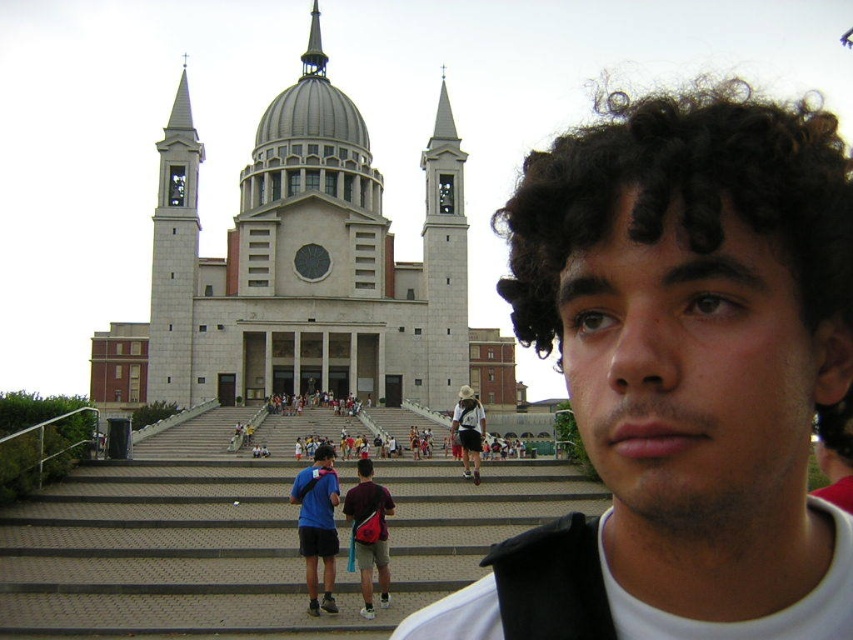
You are standing at the bottom of the church steps and looking up. Which object, the gray stone church at center or the shiny silver spire at upper center, is closer to you?

The gray stone church at center is closer to you because it is in front of the shiny silver spire at upper center.

You are a photographer planning to take a wide shot of the gray stone church at center and the white stone bell tower at left. Based on their relative sizes, which one would likely occupy more space in your photo?

The gray stone church at center is wider than the white stone bell tower at left, so it would occupy more space in the photo.